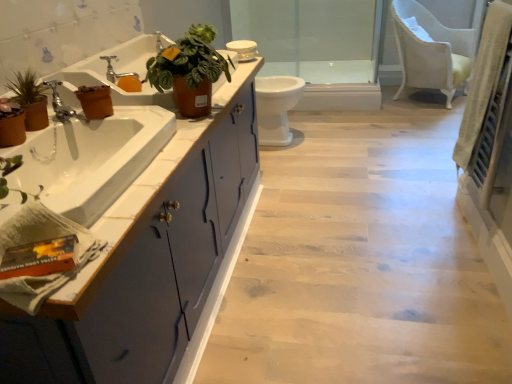
Question: Should I look upward or downward to see silver metallic faucet at upper left, the first tap positioned from the back?

Choices:
 (A) down
 (B) up

Answer: (B)

Question: Is white glossy toilet at center positioned behind matte brown flowerpot at left, arranged as the first flowerpot when ordered from the bottom?

Choices:
 (A) no
 (B) yes

Answer: (B)

Question: Is white glossy toilet at center wider than matte brown flowerpot at left, the 2th flowerpot from the right?

Choices:
 (A) yes
 (B) no

Answer: (A)

Question: Considering the relative sizes of white glossy toilet at center and matte brown flowerpot at left, which appears as the 2th flowerpot when viewed from the top, in the image provided, is white glossy toilet at center thinner than matte brown flowerpot at left, which appears as the 2th flowerpot when viewed from the top,?

Choices:
 (A) no
 (B) yes

Answer: (A)

Question: From the image's perspective, is white glossy toilet at center above matte brown flowerpot at left, which appears as the 2th flowerpot when viewed from the top?

Choices:
 (A) yes
 (B) no

Answer: (A)

Question: Is white glossy toilet at center aimed at matte brown flowerpot at left, arranged as the first flowerpot when ordered from the bottom?

Choices:
 (A) no
 (B) yes

Answer: (A)

Question: Can you confirm if white glossy toilet at center is shorter than matte brown flowerpot at left, the 2th flowerpot from the right?

Choices:
 (A) no
 (B) yes

Answer: (A)

Question: Are brown terracotta pot at left, which is the first flowerpot in back-to-front order, and leather-like terracotta pot at upper center, positioned as the second houseplant in left-to-right order, located far from each other?

Choices:
 (A) no
 (B) yes

Answer: (A)

Question: Considering the relative sizes of brown terracotta pot at left, which is the 1th flowerpot from right to left, and leather-like terracotta pot at upper center, positioned as the second houseplant in left-to-right order, in the image provided, is brown terracotta pot at left, which is the 1th flowerpot from right to left, taller than leather-like terracotta pot at upper center, positioned as the second houseplant in left-to-right order,?

Choices:
 (A) yes
 (B) no

Answer: (B)

Question: From the image's perspective, is brown terracotta pot at left, which is the second flowerpot in bottom-to-top order, above leather-like terracotta pot at upper center, positioned as the second houseplant in left-to-right order?

Choices:
 (A) no
 (B) yes

Answer: (A)

Question: Does brown terracotta pot at left, which is the first flowerpot in back-to-front order, have a lesser height compared to leather-like terracotta pot at upper center, positioned as the second houseplant in left-to-right order?

Choices:
 (A) yes
 (B) no

Answer: (A)

Question: Is brown terracotta pot at left, which is the first flowerpot in back-to-front order, behind leather-like terracotta pot at upper center, which appears as the 1th houseplant when viewed from the right?

Choices:
 (A) no
 (B) yes

Answer: (B)

Question: Is leather-like terracotta pot at upper center, which appears as the 1th houseplant when viewed from the right, at the back of brown terracotta pot at left, which is the 1th flowerpot from right to left?

Choices:
 (A) yes
 (B) no

Answer: (B)

Question: Is brown terracotta pot at left, which is the 1th flowerpot from right to left, oriented towards matte blue cabinet at left?

Choices:
 (A) no
 (B) yes

Answer: (A)